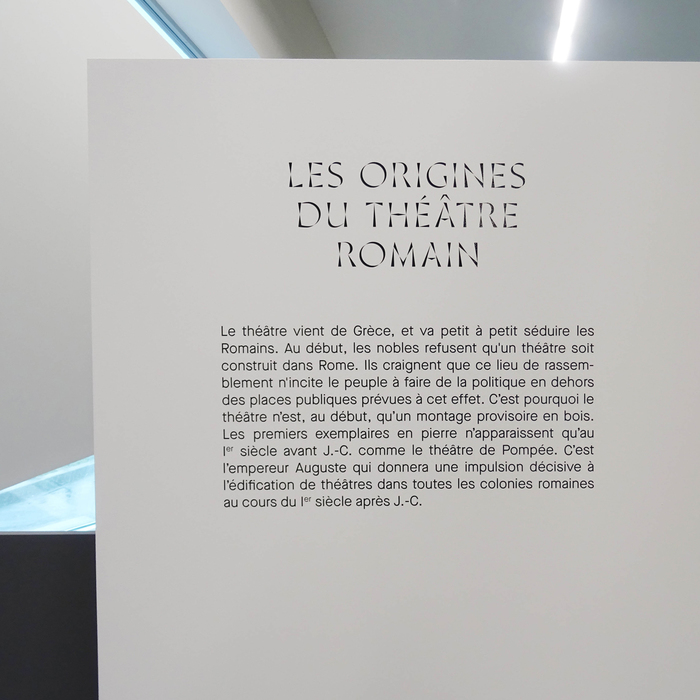
Find the location of a particular element. The height and width of the screenshot is (700, 700). wall is located at coordinates (60, 384).